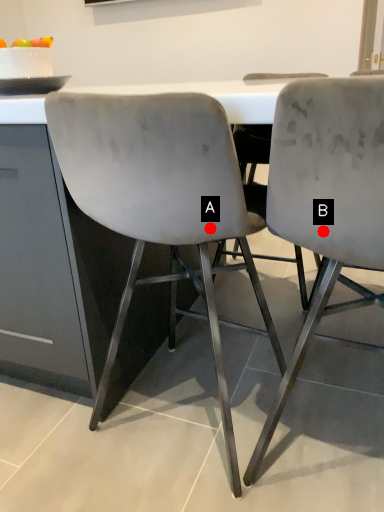
Question: Two points are circled on the image, labeled by A and B beside each circle. Which point is closer to the camera taking this photo?

Choices:
 (A) A is closer
 (B) B is closer

Answer: (B)